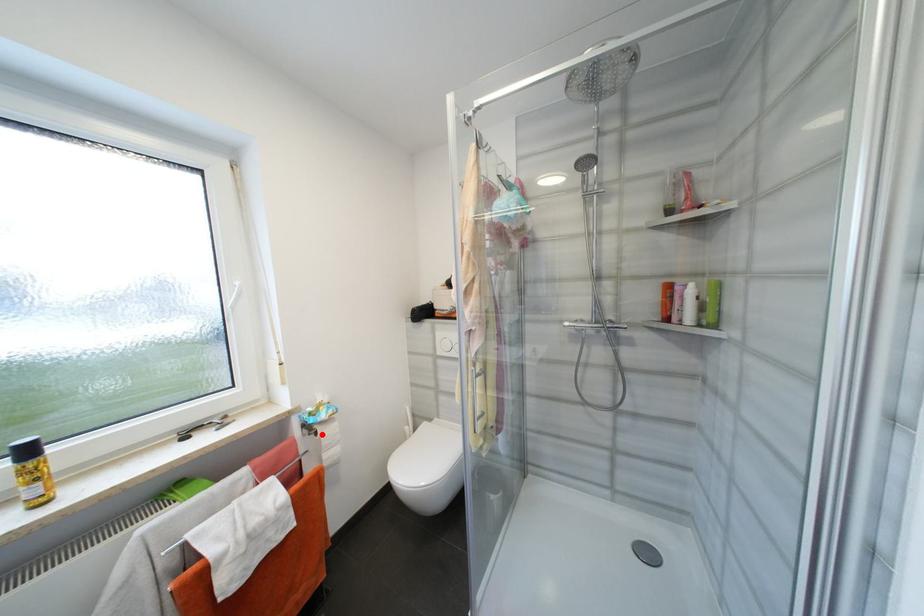
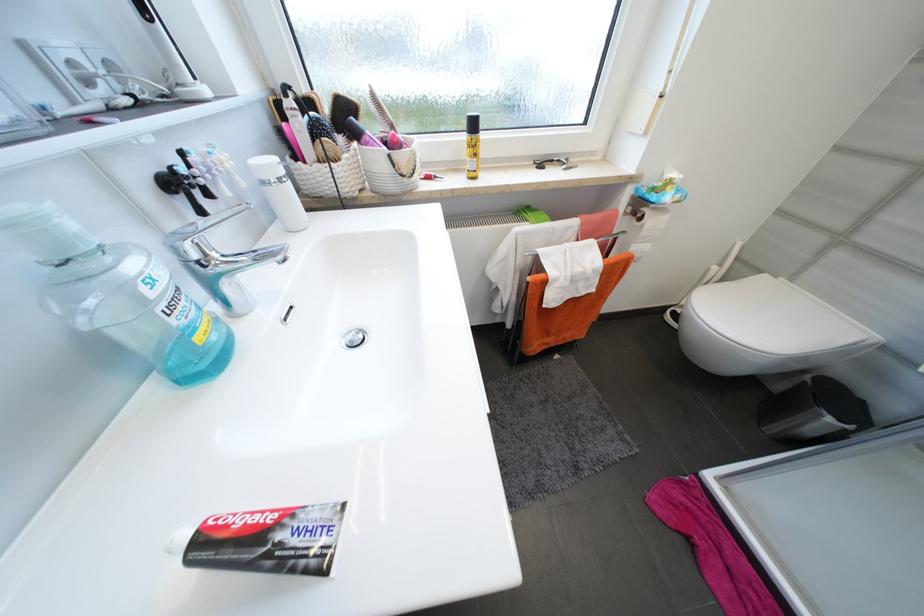
Locate, in the second image, the point that corresponds to the highlighted location in the first image.

(647, 219)